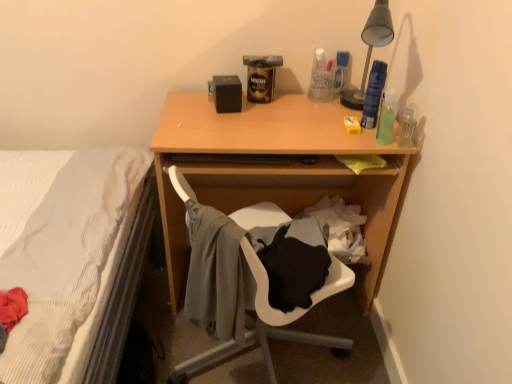
You are a GUI agent. You are given a task and a screenshot of the screen. Output one action in this format:
    pyautogui.click(x=<x>, y=<y>)
    Task: Click on the free space to the back side of translucent plastic spray can at upper right, marked as the 3th bottle in a front-to-back arrangement
    
    Given the screenshot: What is the action you would take?
    pyautogui.click(x=354, y=105)